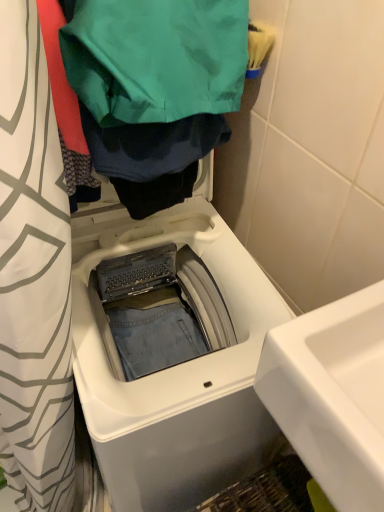
Question: Looking at their shapes, would you say white plastic washing machine at center is wider or thinner than white glossy sink at lower right?

Choices:
 (A) thin
 (B) wide

Answer: (B)

Question: From the image's perspective, relative to white glossy sink at lower right, is white plastic washing machine at center above or below?

Choices:
 (A) above
 (B) below

Answer: (B)

Question: Which is nearer to the white glossy sink at lower right?

Choices:
 (A) green fabric bag at upper center
 (B) white plastic washing machine at center

Answer: (B)

Question: Which object is the closest to the green fabric bag at upper center?

Choices:
 (A) white glossy sink at lower right
 (B) white plastic washing machine at center

Answer: (B)